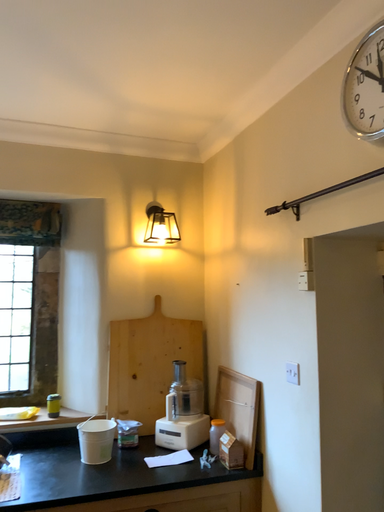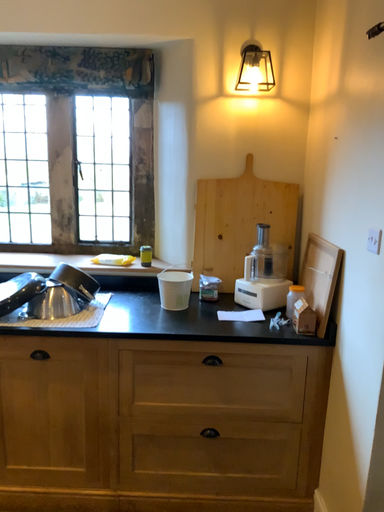
Question: Which way did the camera rotate in the video?

Choices:
 (A) rotated upward
 (B) rotated downward

Answer: (B)